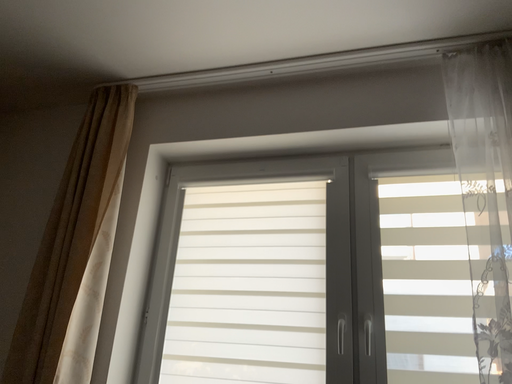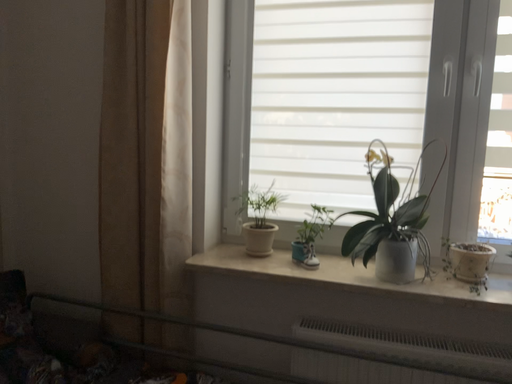
Question: Which way did the camera rotate in the video?

Choices:
 (A) rotated downward
 (B) rotated upward

Answer: (A)